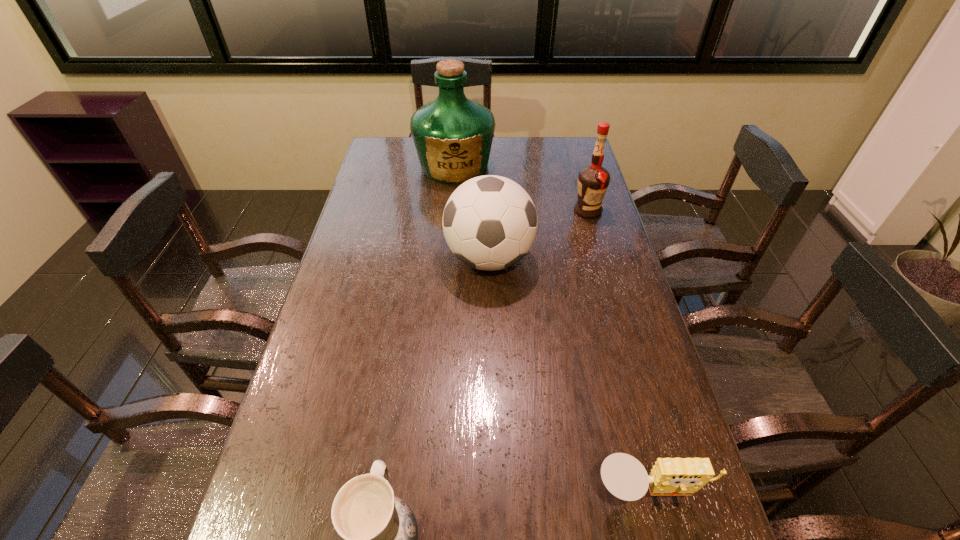
Locate an element on the screen. This screenshot has height=540, width=960. object that is at the far edge is located at coordinates (453, 135).

In order to click on liquor that is positioned at the right edge in this screenshot , I will do `click(593, 180)`.

Find the location of `sponge present at the right edge`. sponge present at the right edge is located at coordinates (624, 476).

This screenshot has height=540, width=960. Identify the location of vacant space at the left edge. (327, 295).

You are a GUI agent. You are given a task and a screenshot of the screen. Output one action in this format:
    pyautogui.click(x=<x>, y=<y>)
    Task: Click on the vacant space at the right edge of the desktop
    
    Given the screenshot: What is the action you would take?
    pyautogui.click(x=595, y=239)

At what (x,y) coordinates should I click in order to perform the action: click on vacant point at the far left corner. Please return your answer as a coordinate pair (x, y). Looking at the image, I should click on coord(379,162).

In the image, there is a desktop. Where is `free space at the far right corner`? The height and width of the screenshot is (540, 960). free space at the far right corner is located at coordinates (588, 165).

Identify the location of vacant region between the third tallest object and the right liquor. point(539,234).

Image resolution: width=960 pixels, height=540 pixels. In order to click on free area in between the third farthest object and the shorter liquor in this screenshot , I will do `click(539, 234)`.

Locate an element on the screen. The width and height of the screenshot is (960, 540). object that is the third nearest to the second shortest object is located at coordinates [593, 180].